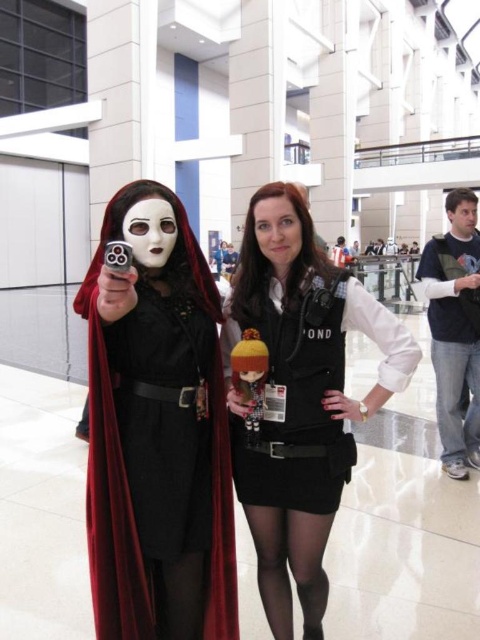
Consider the image. You are a costume designer preparing for a photoshoot. You need to ensure that the velvet black cape at center and the navy blue fleece at right are positioned so that neither overlaps. Given their sizes, which costume should you place closer to the camera to prevent overlap?

The velvet black cape at center is larger in size compared to the navy blue fleece at right. To prevent overlap, place the navy blue fleece at right closer to the camera since it is smaller and will take up less space in the frame.

You are a photographer at a convention center and want to take a photo of the matte black vest at center and navy blue fleece at right. Since you can only focus on one object at a time, which one should you focus on to ensure it appears clearer in the photo?

The matte black vest at center is closer to the viewer than the navy blue fleece at right, so focusing on the matte black vest at center will ensure it appears clearer in the photo.